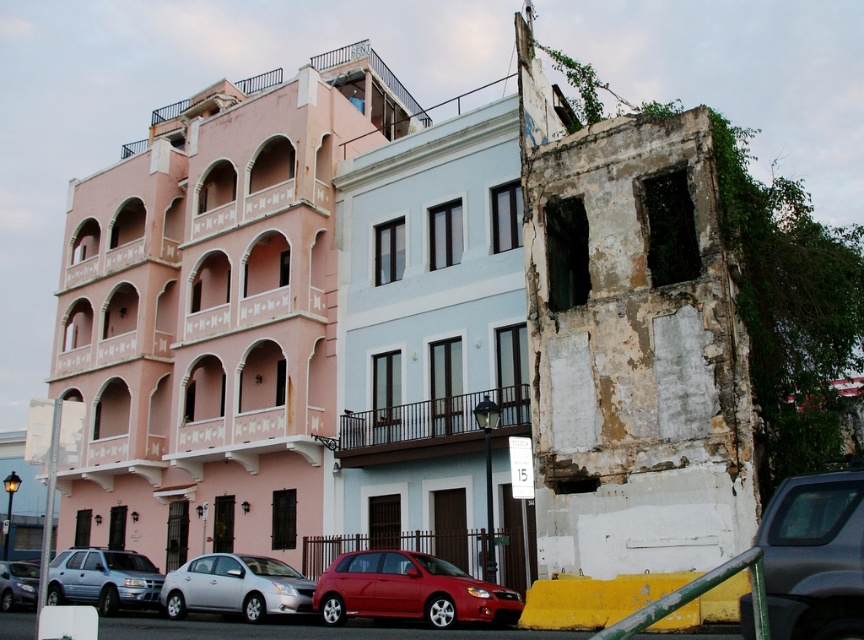
You are a pedestrian standing on the street in front of the three buildings. You see a matte silver suv at lower left and a metallic silver sedan at lower left. Which vehicle is positioned higher up relative to the other?

The matte silver suv at lower left is located above the metallic silver sedan at lower left, so it is positioned higher up.

You are a delivery driver who needs to park your 5.5 meter long truck between the shiny red hatchback at center and the silver metallic sedan at lower left. Can you fit your truck in the space between them?

The distance between the shiny red hatchback at center and the silver metallic sedan at lower left is 6.44 meters. Since your truck is 5.5 meters long, there is enough space to park between them as 6.44 meters is greater than 5.5 meters.